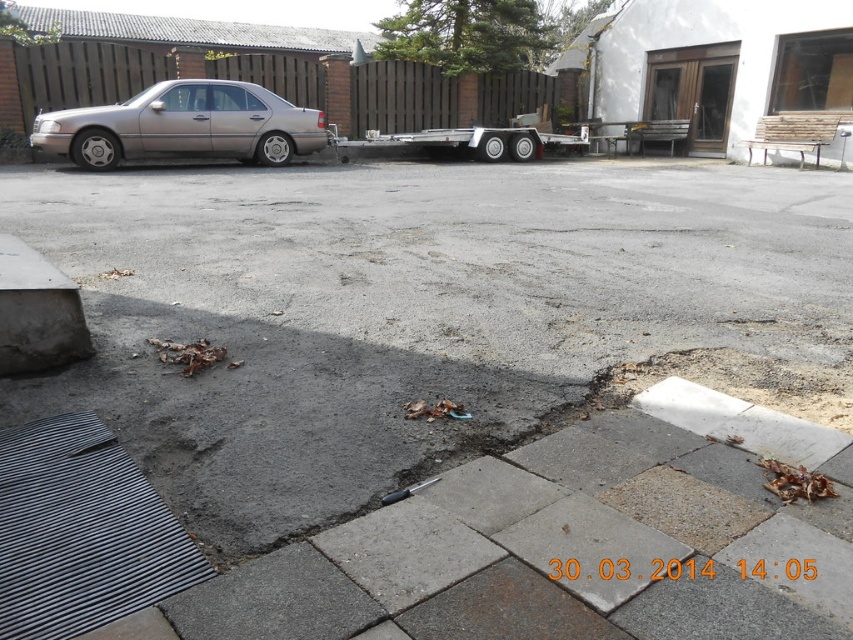
Is metallic gold car at left thinner than silver metallic trailer truck at center?

Indeed, metallic gold car at left has a lesser width compared to silver metallic trailer truck at center.

Who is lower down, metallic gold car at left or silver metallic trailer truck at center?

metallic gold car at left is below.

This screenshot has height=640, width=853. What do you see at coordinates (184, 125) in the screenshot? I see `metallic gold car at left` at bounding box center [184, 125].

What are the coordinates of `metallic gold car at left` in the screenshot? It's located at (184, 125).